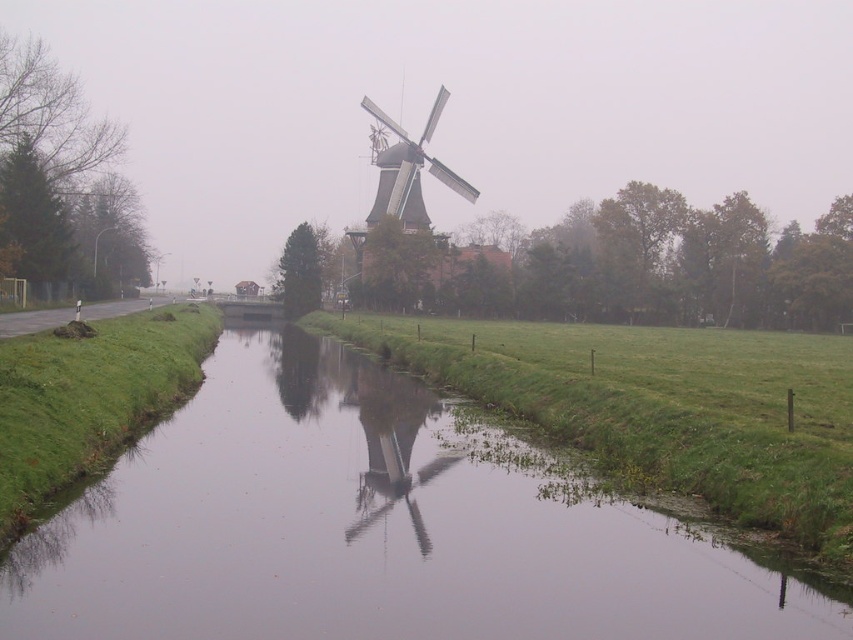
Does green grassy stream at center have a larger size compared to greenish-brown wooden windmill at center?

Incorrect, green grassy stream at center is not larger than greenish-brown wooden windmill at center.

Between green grassy stream at center and greenish-brown wooden windmill at center, which one appears on the right side from the viewer's perspective?

green grassy stream at center is more to the right.

Find the location of a particular element. green grassy stream at center is located at coordinates (367, 531).